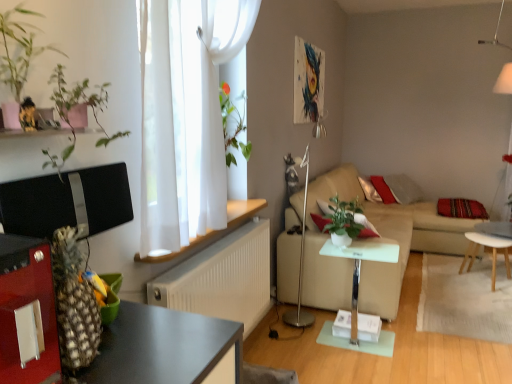
Identify the location of light wood/wooden stool at lower right, which is counted as the 1th table, starting from the back. This screenshot has width=512, height=384. (492, 252).

This screenshot has width=512, height=384. Describe the element at coordinates (25, 305) in the screenshot. I see `wooden pineapple at left` at that location.

In order to face white matte lampshade at upper right, marked as the 1th lamp in a top-to-bottom arrangement, should I rotate leftwards or rightwards?

A 31.161 degree turn to the right will do.

How much space does white matte lampshade at upper right, arranged as the 2th lamp when ordered from the bottom, occupy vertically?

white matte lampshade at upper right, arranged as the 2th lamp when ordered from the bottom, is 3.48 feet tall.

Image resolution: width=512 pixels, height=384 pixels. I want to click on white textured radiator at center, so click(222, 279).

What is the approximate width of beige fabric couch at center-right?

The width of beige fabric couch at center-right is 1.69 meters.

Where is `green matte plant at upper left`? This screenshot has height=384, width=512. green matte plant at upper left is located at coordinates (18, 50).

What do you see at coordinates (301, 261) in the screenshot? The width and height of the screenshot is (512, 384). I see `silver metallic floor lamp at center, positioned as the 1th lamp in left-to-right order` at bounding box center [301, 261].

Where is `green matte plant at center, which is counted as the 1th plant, starting from the bottom`? This screenshot has height=384, width=512. green matte plant at center, which is counted as the 1th plant, starting from the bottom is located at coordinates (344, 219).

Is light wood/wooden stool at lower right, the first table in the right-to-left sequence, aimed at green matte plant at upper left, arranged as the first plant when viewed from the front?

No.

Is light wood/wooden stool at lower right, the first table in the right-to-left sequence, closer to camera compared to green matte plant at upper left, which is the 1th plant from top to bottom?

That is False.

Based on the photo, from a real-world perspective, who is located higher, light wood/wooden stool at lower right, the first table in the right-to-left sequence, or green matte plant at upper left, the second plant in the right-to-left sequence?

From a 3D spatial view, green matte plant at upper left, the second plant in the right-to-left sequence, is above.

From the image's perspective, relative to green matte plant at upper left, arranged as the first plant when viewed from the front, is light wood/wooden stool at lower right, which is counted as the 1th table, starting from the back, above or below?

From the image's perspective, light wood/wooden stool at lower right, which is counted as the 1th table, starting from the back, appears below green matte plant at upper left, arranged as the first plant when viewed from the front.

Based on the photo, how many degrees apart are the facing directions of beige fabric couch at center-right and white sheer curtain at upper center?

0.1 degrees.

From a real-world perspective, between beige fabric couch at center-right and white sheer curtain at upper center, who is vertically higher?

white sheer curtain at upper center.

Between beige fabric couch at center-right and white sheer curtain at upper center, which one is positioned behind?

beige fabric couch at center-right is behind.

Is green matte plant at center, which appears as the 2th plant when viewed from the top, next to beige fabric couch at center-right?

No, green matte plant at center, which appears as the 2th plant when viewed from the top, is not with beige fabric couch at center-right.

Where is `studio couch on the right side of green matte plant at center, the second plant from the front`? The image size is (512, 384). studio couch on the right side of green matte plant at center, the second plant from the front is located at coordinates (382, 239).

Is green matte plant at center, the second plant from the front, in front of or behind beige fabric couch at center-right in the image?

In the image, green matte plant at center, the second plant from the front, appears behind beige fabric couch at center-right.

Is green matte plant at center, which is the second plant in left-to-right order, looking in the opposite direction of beige fabric couch at center-right?

No, green matte plant at center, which is the second plant in left-to-right order,'s orientation is not away from beige fabric couch at center-right.

From the image's perspective, does silver metallic floor lamp at center, positioned as the 1th lamp in left-to-right order, appear lower than green matte plant at upper left?

Indeed, from the image's perspective, silver metallic floor lamp at center, positioned as the 1th lamp in left-to-right order, is shown beneath green matte plant at upper left.

Does point (303, 246) lie in front of point (14, 82)?

No, it is not.

Looking at the image, does silver metallic floor lamp at center, positioned as the second lamp in top-to-bottom order, seem bigger or smaller compared to green matte plant at upper left?

Clearly, silver metallic floor lamp at center, positioned as the second lamp in top-to-bottom order, is larger in size than green matte plant at upper left.

Between silver metallic floor lamp at center, the first lamp when ordered from bottom to top, and wooden pineapple at left, which one has smaller size?

wooden pineapple at left.

From a real-world perspective, relative to wooden pineapple at left, is silver metallic floor lamp at center, the second lamp viewed from the right, vertically above or below?

silver metallic floor lamp at center, the second lamp viewed from the right, is situated lower than wooden pineapple at left in the real world.

From their relative heights in the image, would you say silver metallic floor lamp at center, positioned as the second lamp in top-to-bottom order, is taller or shorter than wooden pineapple at left?

Considering their sizes, silver metallic floor lamp at center, positioned as the second lamp in top-to-bottom order, has more height than wooden pineapple at left.

Could you measure the distance between silver metallic floor lamp at center, the second lamp viewed from the right, and wooden pineapple at left?

silver metallic floor lamp at center, the second lamp viewed from the right, and wooden pineapple at left are 7.94 feet apart from each other.

Is white textured radiator at center turned away from green matte plant at center, marked as the 1th plant in a back-to-front arrangement?

That's not correct — white textured radiator at center is not looking away from green matte plant at center, marked as the 1th plant in a back-to-front arrangement.

Can you confirm if white textured radiator at center is taller than green matte plant at center, marked as the first plant in a right-to-left arrangement?

Yes, white textured radiator at center is taller than green matte plant at center, marked as the first plant in a right-to-left arrangement.

From a real-world perspective, is white textured radiator at center positioned above or below green matte plant at center, which is the second plant in left-to-right order?

white textured radiator at center is situated lower than green matte plant at center, which is the second plant in left-to-right order, in the real world.

Can you confirm if white textured radiator at center is smaller than green matte plant at center, which is the second plant in left-to-right order?

No, white textured radiator at center is not smaller than green matte plant at center, which is the second plant in left-to-right order.

In the image, is wooden pineapple at left positioned in front of or behind white glossy side table at center, which is the 2th table in back-to-front order?

wooden pineapple at left is positioned closer to the viewer than white glossy side table at center, which is the 2th table in back-to-front order.

From the image's perspective, which one is positioned lower, wooden pineapple at left or white glossy side table at center, the 2th table in the right-to-left sequence?

white glossy side table at center, the 2th table in the right-to-left sequence, from the image's perspective.

You are a GUI agent. You are given a task and a screenshot of the screen. Output one action in this format:
    pyautogui.click(x=<x>, y=<y>)
    Task: Click on the 2nd table positioned below the green matte plant at upper left, which is the 1th plant from top to bottom (from a real-world perspective)
    
    Given the screenshot: What is the action you would take?
    pyautogui.click(x=492, y=252)

The width and height of the screenshot is (512, 384). What are the coordinates of `curtain above the beige fabric couch at center-right (from the image's perspective)` in the screenshot? It's located at (185, 116).

Looking at the image, which one is located further to white glossy side table at center, the 2th table in the right-to-left sequence, light wood/wooden stool at lower right, the first table in the right-to-left sequence, or white matte lampshade at upper right, arranged as the second lamp when viewed from the left?

white matte lampshade at upper right, arranged as the second lamp when viewed from the left, is further to white glossy side table at center, the 2th table in the right-to-left sequence.

When comparing their distances from white sheer curtain at upper center, does white glossy side table at center, which is the 2th table in back-to-front order, or wooden pineapple at left seem closer?

wooden pineapple at left is closer to white sheer curtain at upper center.

Based on their spatial positions, is green matte plant at center, which is counted as the 1th plant, starting from the bottom, or green matte plant at upper left, which is the 1th plant from top to bottom, further from beige fabric couch at center-right?

The object further to beige fabric couch at center-right is green matte plant at upper left, which is the 1th plant from top to bottom.

Based on their spatial positions, is silver metallic floor lamp at center, the second lamp viewed from the right, or wooden pineapple at left further from beige fabric couch at center-right?

wooden pineapple at left is positioned further to the anchor beige fabric couch at center-right.

Considering their positions, is beige fabric couch at center-right positioned further to white glossy side table at center, the 2th table in the right-to-left sequence, than white matte lampshade at upper right, marked as the 1th lamp in a top-to-bottom arrangement?

The object further to white glossy side table at center, the 2th table in the right-to-left sequence, is white matte lampshade at upper right, marked as the 1th lamp in a top-to-bottom arrangement.

When comparing their distances from wooden pineapple at left, does green matte plant at upper left or green matte plant at center, which is the second plant in left-to-right order, seem further?

green matte plant at center, which is the second plant in left-to-right order, is positioned further to the anchor wooden pineapple at left.

Which object lies further to the anchor point white matte lampshade at upper right, arranged as the second lamp when viewed from the left, white sheer curtain at upper center or green matte plant at upper left?

green matte plant at upper left lies further to white matte lampshade at upper right, arranged as the second lamp when viewed from the left, than the other object.

When comparing their distances from white textured radiator at center, does white glossy side table at center, the 2th table in the right-to-left sequence, or green matte plant at upper left, which is the 1th plant from top to bottom, seem further?

green matte plant at upper left, which is the 1th plant from top to bottom.

Where is `plant between wooden pineapple at left and green matte plant at center, which is the second plant in left-to-right order, along the z-axis`? The height and width of the screenshot is (384, 512). plant between wooden pineapple at left and green matte plant at center, which is the second plant in left-to-right order, along the z-axis is located at coordinates (93, 70).

This screenshot has width=512, height=384. I want to click on plant between green matte plant at upper left, the second plant in the right-to-left sequence, and light wood/wooden stool at lower right, placed as the 2th table when sorted from left to right, in the horizontal direction, so click(x=344, y=219).

Identify the location of houseplant between wooden pineapple at left and silver metallic floor lamp at center, positioned as the second lamp in top-to-bottom order, in the front-back direction. (18, 50).

I want to click on table situated between white textured radiator at center and beige fabric couch at center-right from left to right, so click(x=359, y=267).